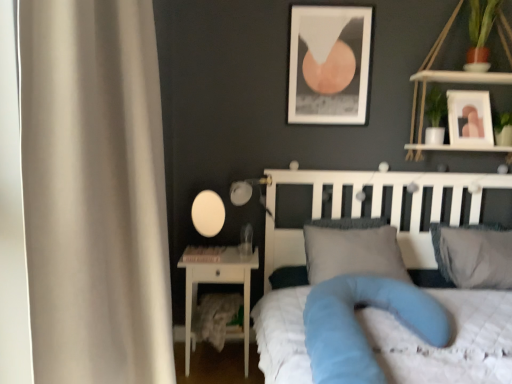
Question: Is matte white picture frame at upper center, which is counted as the 2th picture frame, starting from the right, thinner than white glossy nightstand at lower left?

Choices:
 (A) yes
 (B) no

Answer: (A)

Question: From the image's perspective, is matte white picture frame at upper center, the 1th picture frame from the left, beneath white glossy nightstand at lower left?

Choices:
 (A) no
 (B) yes

Answer: (A)

Question: Can you confirm if matte white picture frame at upper center, which is counted as the 2th picture frame, starting from the right, is smaller than white glossy nightstand at lower left?

Choices:
 (A) no
 (B) yes

Answer: (B)

Question: Does matte white picture frame at upper center, the 1th picture frame from the left, have a larger size compared to white glossy nightstand at lower left?

Choices:
 (A) no
 (B) yes

Answer: (A)

Question: Considering the relative positions of matte white picture frame at upper center, which is counted as the 2th picture frame, starting from the right, and white glossy nightstand at lower left in the image provided, is matte white picture frame at upper center, which is counted as the 2th picture frame, starting from the right, to the left of white glossy nightstand at lower left from the viewer's perspective?

Choices:
 (A) yes
 (B) no

Answer: (B)

Question: Relative to blue fabric mattress at center, is white matte lampshade at center in front or behind?

Choices:
 (A) front
 (B) behind

Answer: (B)

Question: From the image's perspective, is white matte lampshade at center positioned above or below blue fabric mattress at center?

Choices:
 (A) below
 (B) above

Answer: (B)

Question: In terms of height, does white matte lampshade at center look taller or shorter compared to blue fabric mattress at center?

Choices:
 (A) tall
 (B) short

Answer: (A)

Question: From a real-world perspective, is white matte lampshade at center positioned above or below blue fabric mattress at center?

Choices:
 (A) above
 (B) below

Answer: (A)

Question: Considering the positions of white glossy nightstand at lower left and white quilted bed at center in the image, is white glossy nightstand at lower left taller or shorter than white quilted bed at center?

Choices:
 (A) tall
 (B) short

Answer: (B)

Question: In the image, is white glossy nightstand at lower left on the left side or the right side of white quilted bed at center?

Choices:
 (A) right
 (B) left

Answer: (B)

Question: Choose the correct answer: Is white glossy nightstand at lower left inside white quilted bed at center or outside it?

Choices:
 (A) outside
 (B) inside

Answer: (A)

Question: Considering the positions of white glossy nightstand at lower left and white quilted bed at center in the image, is white glossy nightstand at lower left wider or thinner than white quilted bed at center?

Choices:
 (A) wide
 (B) thin

Answer: (B)

Question: Is white wood shelf at upper right inside or outside of white quilted bed at center?

Choices:
 (A) outside
 (B) inside

Answer: (A)

Question: From a real-world perspective, is white wood shelf at upper right positioned above or below white quilted bed at center?

Choices:
 (A) below
 (B) above

Answer: (B)